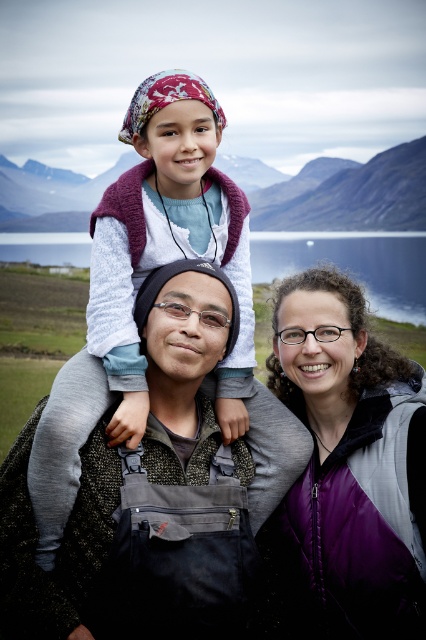
Can you confirm if dark gray fabric at center is positioned to the right of blue water at center?

Indeed, dark gray fabric at center is positioned on the right side of blue water at center.

Is dark gray fabric at center wider than blue water at center?

Incorrect, dark gray fabric at center's width does not surpass blue water at center's.

Who is more forward, [117,548] or [40,236]?

Point [117,548] is in front.

Locate an element on the screen. Image resolution: width=426 pixels, height=640 pixels. dark gray fabric at center is located at coordinates (118, 557).

Can you confirm if dark gray fabric at center is shorter than knitted purple vest at center?

Yes, dark gray fabric at center is shorter than knitted purple vest at center.

Who is more forward, (198, 368) or (221, 417)?

Point (198, 368) is more forward.

Find the location of a particular element. The image size is (426, 640). dark gray fabric at center is located at coordinates pos(118,557).

Which of these two, purple fleece vest at center or knitted purple vest at center, stands shorter?

Standing shorter between the two is knitted purple vest at center.

Describe the element at coordinates (347, 472) in the screenshot. I see `purple fleece vest at center` at that location.

Locate an element on the screen. purple fleece vest at center is located at coordinates (347, 472).